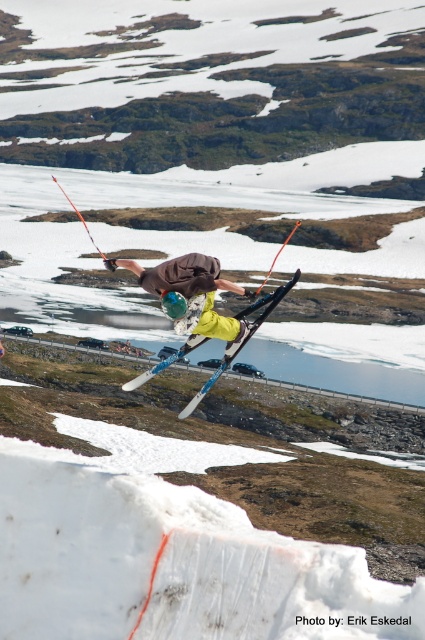
Looking at this image, you are standing at the base of the ramp watching the skier wearing the matte brown jacket at center. If you want to take a photo of the skier with your camera that has a maximum zoom range of 10 meters, will you be able to capture the skier clearly?

The matte brown jacket at center is 9.99 meters away from the viewer. Since the camera can zoom up to 10 meters, you can capture the skier clearly as the distance is within the camera range.

You are a photographer trying to capture the skier wearing the matte brown jacket at center. Based on the coordinates provided, where should you aim your camera to ensure the jacket is in the center of your shot?

You should aim your camera at the coordinates point (190, 289) to ensure the matte brown jacket at center is in the center of your shot.